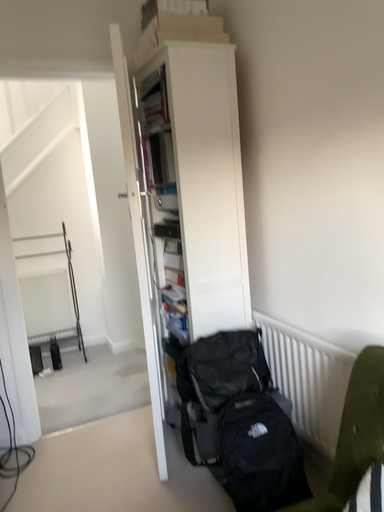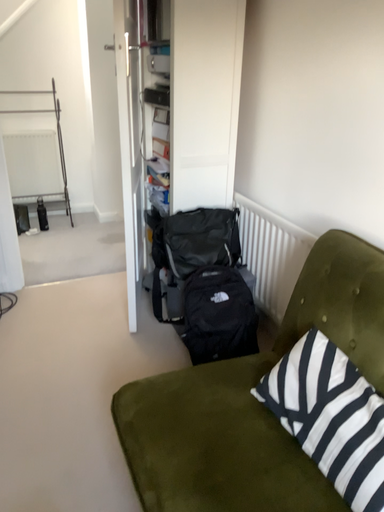
Question: Which way did the camera rotate in the video?

Choices:
 (A) rotated upward
 (B) rotated downward

Answer: (B)